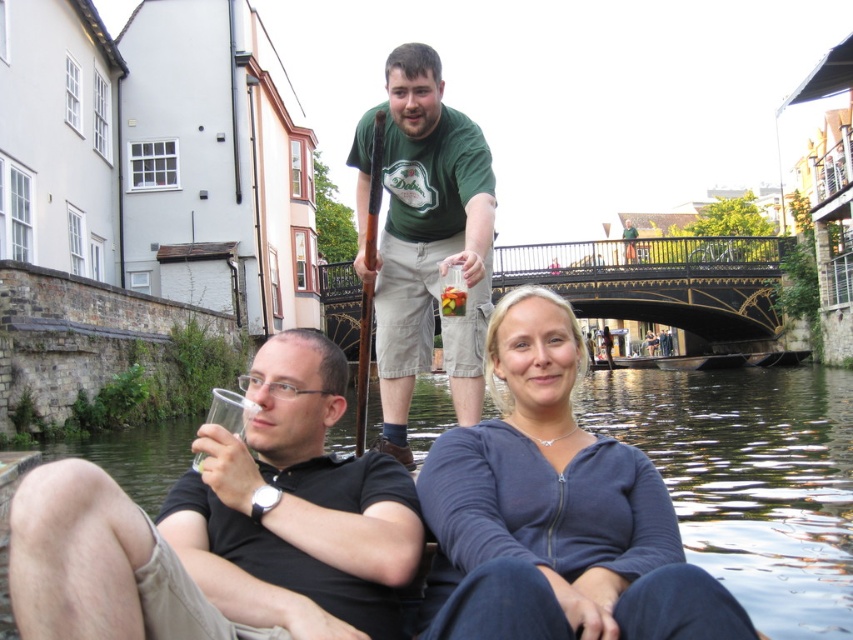
From the picture: Can you confirm if black matte shirt at lower left is positioned below brown wooden paddle at center?

Yes.

Is black matte shirt at lower left smaller than brown wooden paddle at center?

Indeed, black matte shirt at lower left has a smaller size compared to brown wooden paddle at center.

Describe the element at coordinates (230, 522) in the screenshot. The width and height of the screenshot is (853, 640). I see `black matte shirt at lower left` at that location.

Locate an element on the screen. The image size is (853, 640). black matte shirt at lower left is located at coordinates (230, 522).

Can you confirm if transparent plastic water at center is wider than brown wooden paddle at center?

Correct, the width of transparent plastic water at center exceeds that of brown wooden paddle at center.

Which is below, transparent plastic water at center or brown wooden paddle at center?

transparent plastic water at center

Where is `transparent plastic water at center`? This screenshot has width=853, height=640. transparent plastic water at center is located at coordinates coord(749,480).

Is black matte shirt at lower left shorter than transparent plastic water at center?

In fact, black matte shirt at lower left may be taller than transparent plastic water at center.

Does black matte shirt at lower left have a greater width compared to transparent plastic water at center?

No.

Between point (258, 472) and point (839, 524), which one is positioned in front?

Point (258, 472) is in front.

I want to click on black matte shirt at lower left, so 230,522.